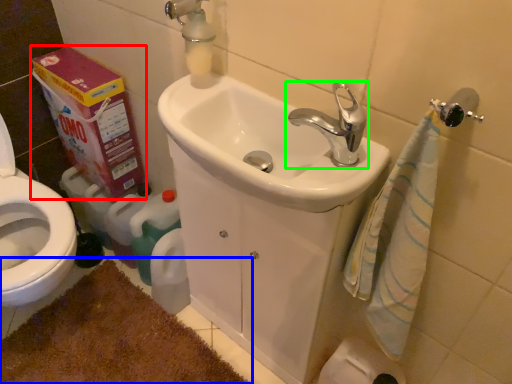
Question: Which object is the closest to the carton (highlighted by a red box)? Choose among these: bath mat (highlighted by a blue box) or tap (highlighted by a green box).

Choices:
 (A) bath mat
 (B) tap

Answer: (A)